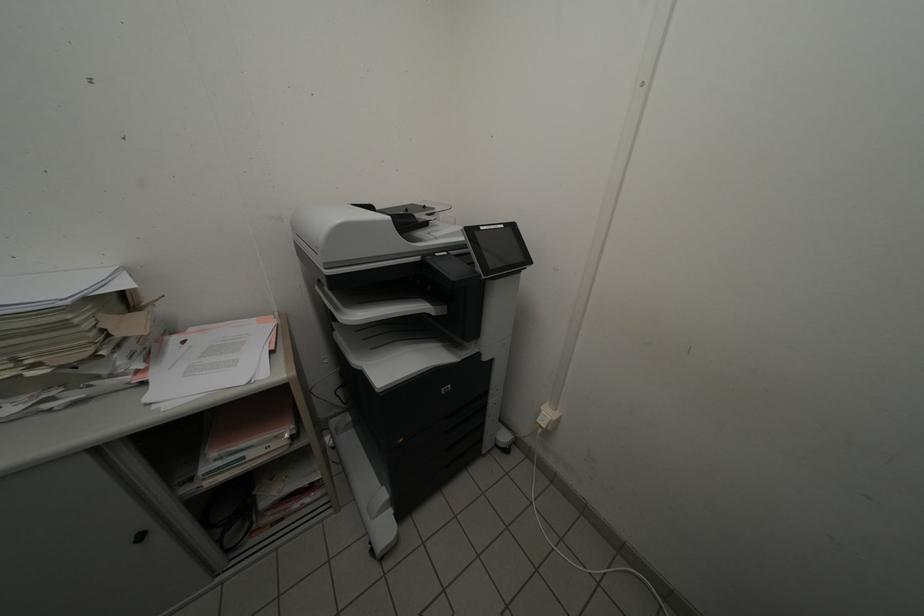
I want to click on printer touchscreen, so click(x=496, y=248).